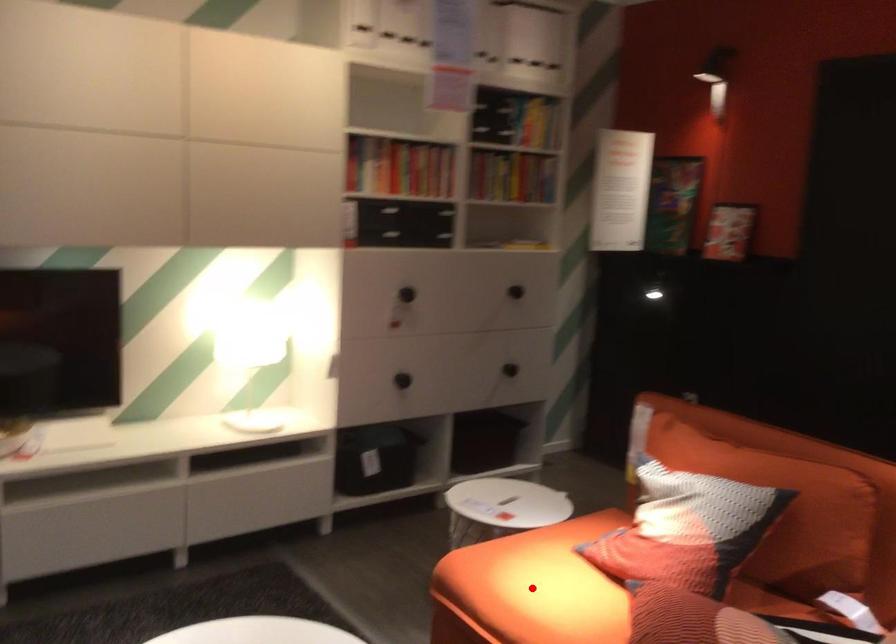
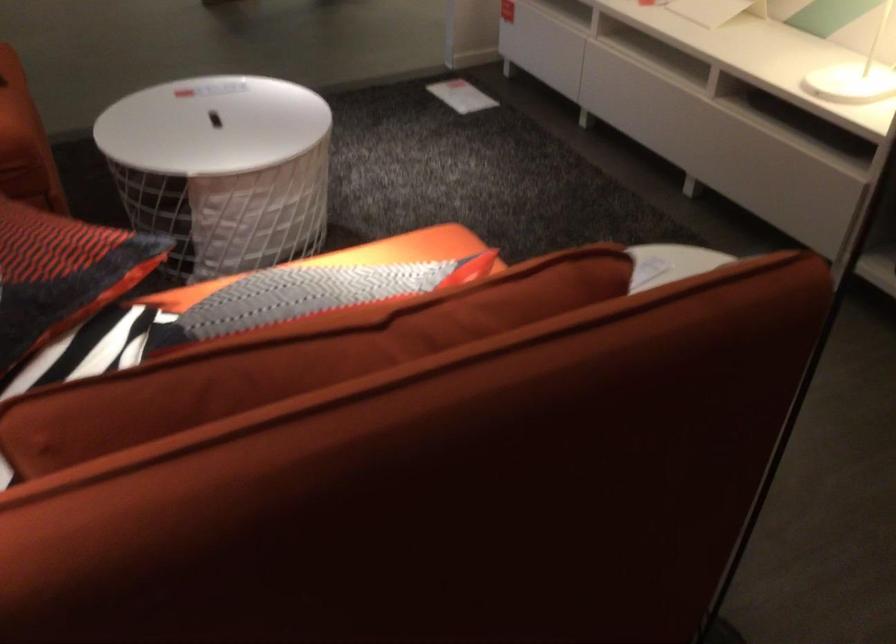
Question: I am providing you with two images of the same scene from different viewpoints. A red point is marked on the first image. Can you still see the location of the red point in image 2?

Choices:
 (A) Yes
 (B) No

Answer: (B)